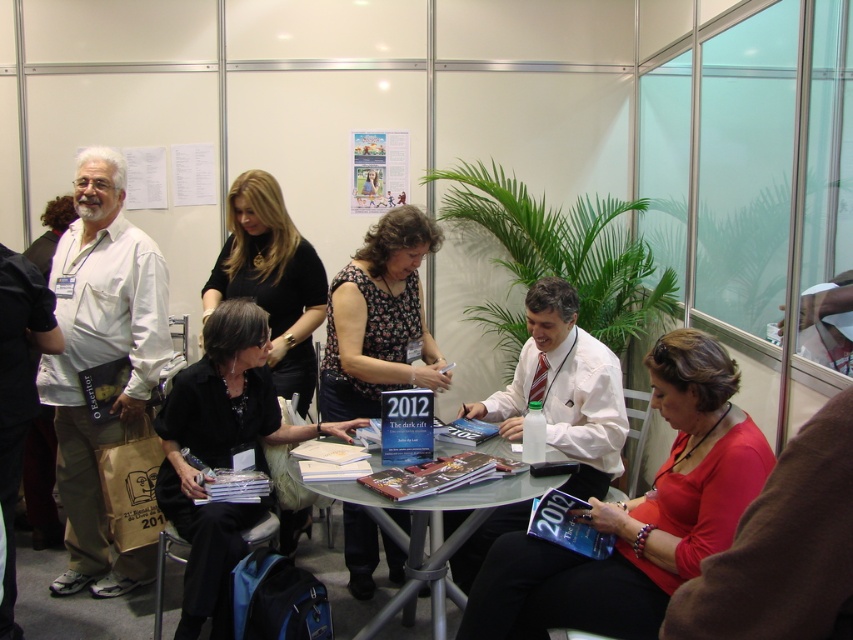
You are a photographer standing at the back of the room. You want to take a photo of the black fabric shirt at center and the clear glass table at center. The camera you are using has a minimum focus distance of 38 inches. Will you be able to focus on both objects without moving closer?

The black fabric shirt at center is 38.01 inches from the clear glass table at center. Since the camera requires a minimum focus distance of 38 inches, the distance between them is just slightly over the required limit. Therefore, you can focus on both objects without moving closer.